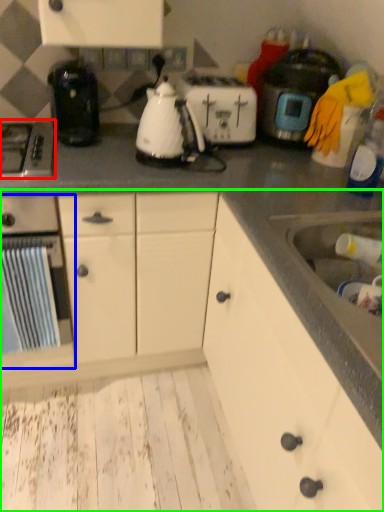
Question: Considering the real-world distances, which object is closest to gas stove (highlighted by a red box)? kitchen appliance (highlighted by a blue box) or cabinetry (highlighted by a green box).

Choices:
 (A) kitchen appliance
 (B) cabinetry

Answer: (A)